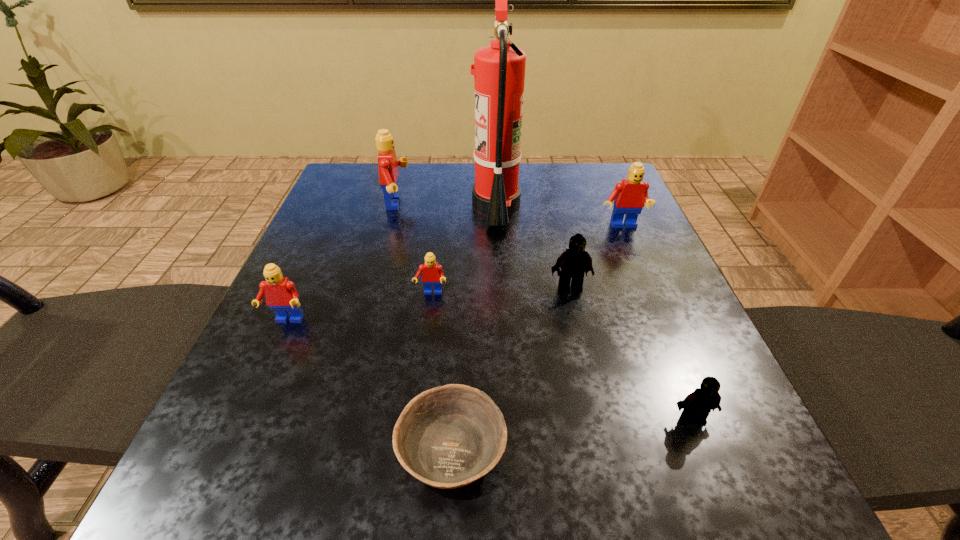
Where is `free space at the near edge`? This screenshot has height=540, width=960. free space at the near edge is located at coordinates (558, 506).

The width and height of the screenshot is (960, 540). I want to click on vacant area at the left edge of the desktop, so click(208, 425).

Where is `vacant region at the right edge of the desktop`? The width and height of the screenshot is (960, 540). vacant region at the right edge of the desktop is located at coordinates (679, 334).

I want to click on vacant space at the far left corner, so click(376, 194).

Locate an element on the screen. The width and height of the screenshot is (960, 540). vacant space at the near left corner is located at coordinates (258, 492).

Locate an element on the screen. Image resolution: width=960 pixels, height=540 pixels. vacant space at the far right corner is located at coordinates (572, 185).

Identify the location of vacant area that lies between the second smallest red Lego and the second red Lego from right to left. The height and width of the screenshot is (540, 960). (358, 307).

In order to click on vacant area that lies between the fifth nearest Lego and the bowl in this screenshot , I will do `click(537, 339)`.

This screenshot has height=540, width=960. Identify the location of unoccupied position between the fifth Lego from right to left and the smaller black Lego. (544, 311).

Where is `vacant area that lies between the leftmost object and the shortest object`? The height and width of the screenshot is (540, 960). vacant area that lies between the leftmost object and the shortest object is located at coordinates (369, 386).